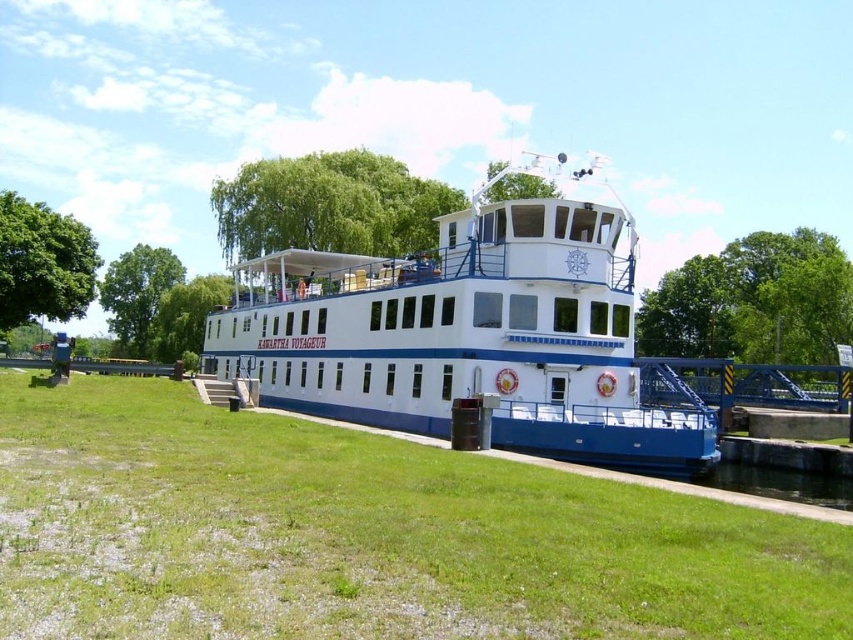
Question: Estimate the real-world distances between objects in this image. Which object is closer to the white matte boat at center?

Choices:
 (A) green leafy tree at right
 (B) green leafy tree at upper center
 (C) green leafy tree at left
 (D) green leafy tree at center

Answer: (B)

Question: Is white matte boat at center to the left of green leafy tree at upper center from the viewer's perspective?

Choices:
 (A) no
 (B) yes

Answer: (A)

Question: Is green leafy tree at upper center smaller than green leafy tree at center?

Choices:
 (A) no
 (B) yes

Answer: (A)

Question: Estimate the real-world distances between objects in this image. Which object is farther from the green grass at lower left?

Choices:
 (A) green leafy tree at left
 (B) green leafy tree at center
 (C) green leafy tree at upper center

Answer: (B)

Question: Which object is farther from the camera taking this photo?

Choices:
 (A) white matte boat at center
 (B) green leafy tree at upper center
 (C) green grass at lower left
 (D) green leafy tree at right

Answer: (B)

Question: In this image, where is green grass at lower left located relative to green leafy tree at right?

Choices:
 (A) below
 (B) above

Answer: (A)